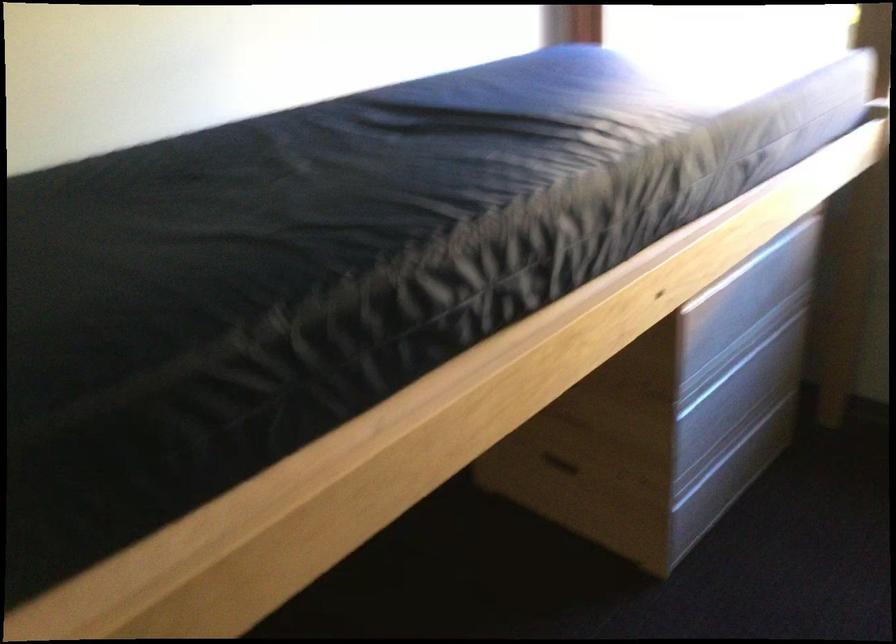
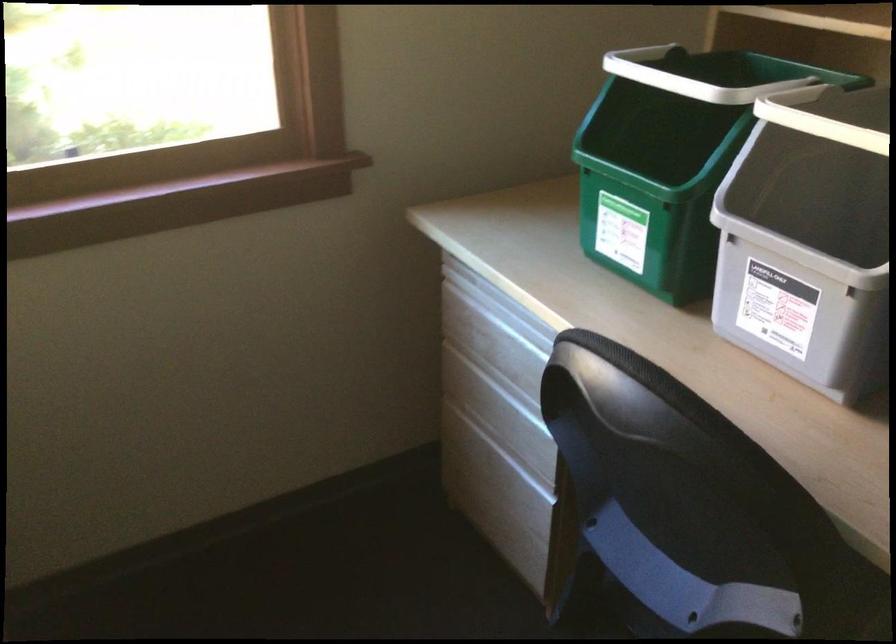
Question: The images are taken continuously from a first-person perspective. In which direction is your viewpoint rotating?

Choices:
 (A) Left
 (B) Right
 (C) Up
 (D) Down

Answer: (B)